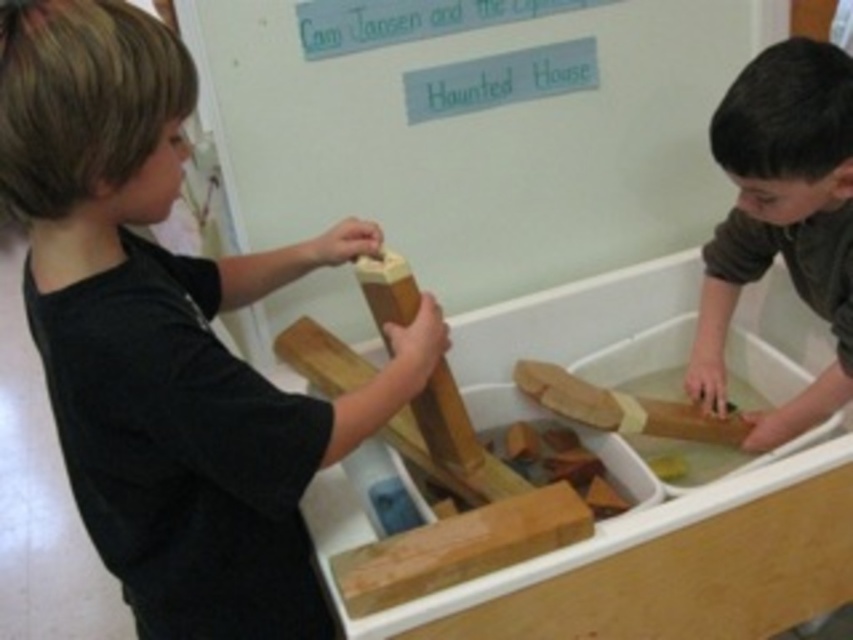
You are a teacher observing the children at the water table. You notice the smooth brown wood at right and the smooth light brown wood at center. Which block is closer to the children?

The smooth brown wood at right is closer to the children because the smooth light brown wood at center is behind it.

You are observing the scene and need to determine the relative heights of the objects. Which object is taller between the matte black shirt at left and the smooth brown wood at right?

The matte black shirt at left is taller than the smooth brown wood at right according to the description.

You are observing two children in an educational setting. You notice a matte black shirt at left and a wooden sign at upper center. Which object is located to the left of the other?

The matte black shirt at left is positioned on the left side of wooden sign at upper center.